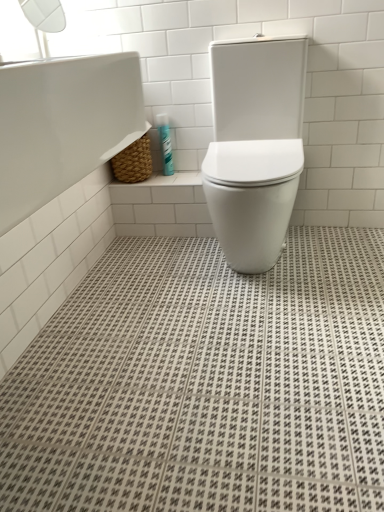
Question: Based on their sizes in the image, would you say transparent plastic window screen at upper left is bigger or smaller than white glossy toilet at center?

Choices:
 (A) small
 (B) big

Answer: (A)

Question: From their relative heights in the image, would you say transparent plastic window screen at upper left is taller or shorter than white glossy toilet at center?

Choices:
 (A) short
 (B) tall

Answer: (A)

Question: Which object is the closest to the transparent plastic window screen at upper left?

Choices:
 (A) teal plastic toothpaste tube at upper center
 (B) white glossy bathtub at upper left
 (C) white glossy toilet at center

Answer: (A)

Question: Which is nearer to the teal plastic toothpaste tube at upper center?

Choices:
 (A) white glossy toilet at center
 (B) transparent plastic window screen at upper left
 (C) white glossy bathtub at upper left

Answer: (C)